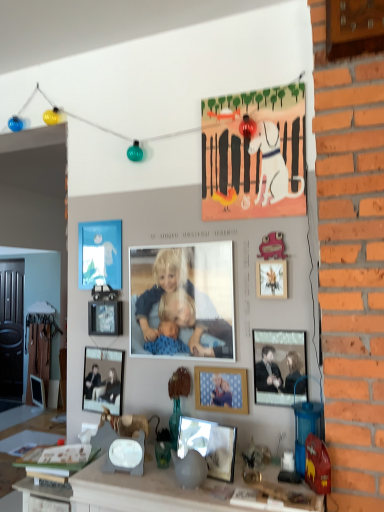
Question: In terms of width, does wooden photo frame at center, the fifth picture frame in the back-to-front sequence, look wider or thinner when compared to matte black picture frame at center, positioned as the third picture frame in back-to-front order?

Choices:
 (A) wide
 (B) thin

Answer: (A)

Question: Visually, is wooden photo frame at center, the sixth picture frame from the left, positioned to the left or to the right of matte black picture frame at center, the sixth picture frame viewed from the front?

Choices:
 (A) left
 (B) right

Answer: (B)

Question: Which of these objects is positioned farthest from the smooth skin baby at center?

Choices:
 (A) pink matte picture frame at upper right, which is the 7th picture frame in left-to-right order
 (B) red plastic toy at lower right
 (C) matte black picture frame at left, which is the eighth picture frame in front-to-back order
 (D) matte paper dog at upper center
 (E) wooden photo frame at center, the fourth picture frame ordered from the bottom

Answer: (C)

Question: Which is nearer to the wooden photo frame at center, the sixth picture frame from the left?

Choices:
 (A) smooth skin baby at center
 (B) blue matte picture frame at upper left, the 2th picture frame viewed from the left
 (C) matte black picture frame at left, arranged as the first picture frame when viewed from the left
 (D) matte paper dog at upper center
 (E) smooth gray stone counter at center

Answer: (A)